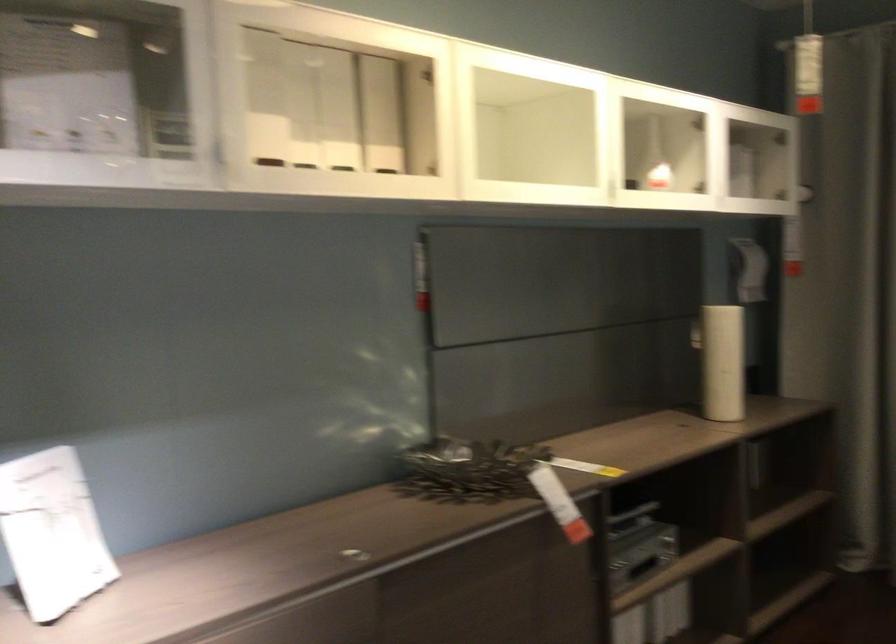
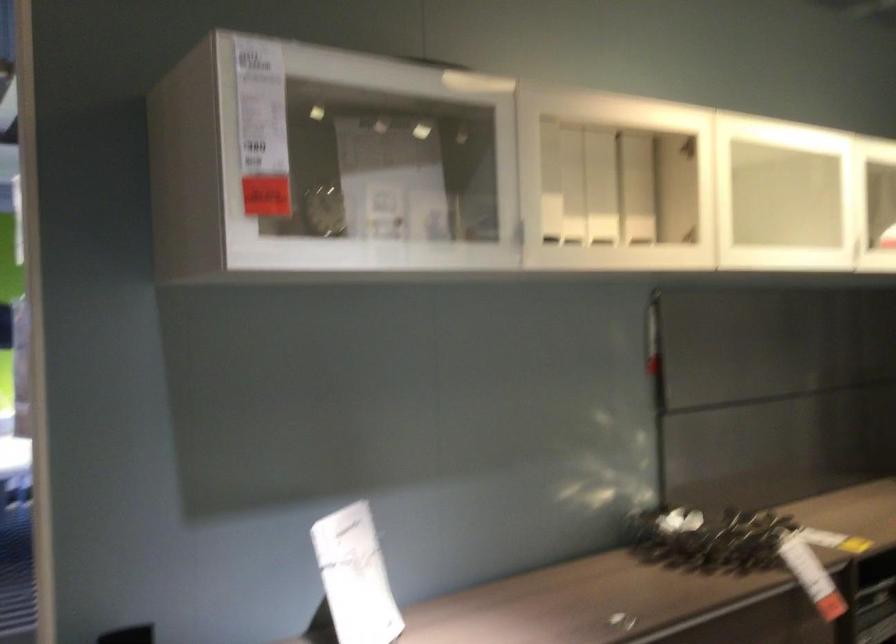
Where in the second image is the point corresponding to point (435, 165) from the first image?

(690, 234)